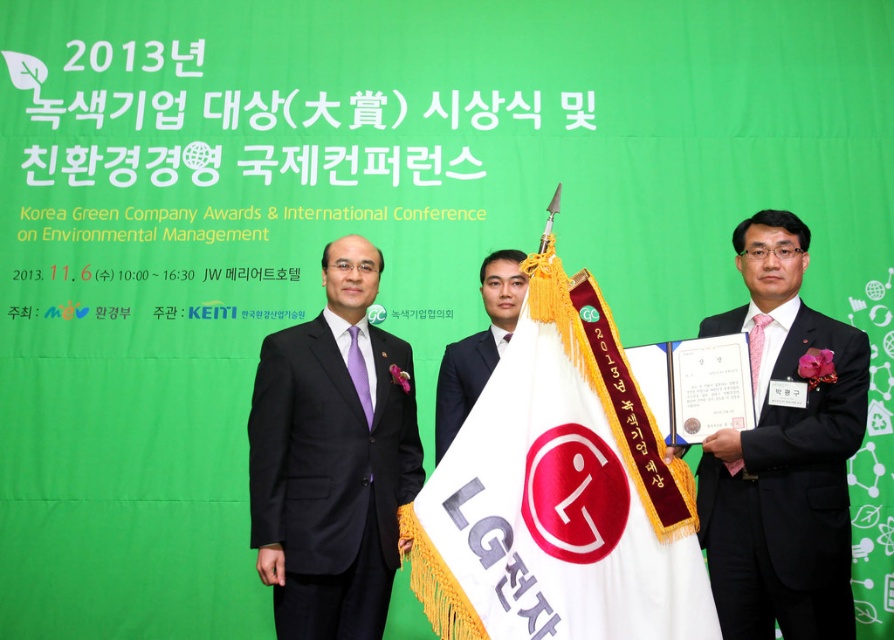
The width and height of the screenshot is (894, 640). Describe the element at coordinates (559, 492) in the screenshot. I see `white fabric flag at center` at that location.

Is point (431, 616) behind point (443, 362)?

No, (431, 616) is in front of (443, 362).

What are the coordinates of `white fabric flag at center` in the screenshot? It's located at (559, 492).

Who is taller, black suit at center or smooth black suit at center?

With more height is black suit at center.

Can you confirm if black suit at center is positioned below smooth black suit at center?

Yes, black suit at center is below smooth black suit at center.

Where is `black suit at center`? The height and width of the screenshot is (640, 894). black suit at center is located at coordinates (332, 458).

Consider the image. Is white fabric flag at center wider than black suit at center?

Yes, white fabric flag at center is wider than black suit at center.

Which is below, white fabric flag at center or black suit at center?

black suit at center

Between point (437, 480) and point (418, 435), which one is positioned in front?

Point (437, 480)

Find the location of `white fabric flag at center`. white fabric flag at center is located at coordinates (559, 492).